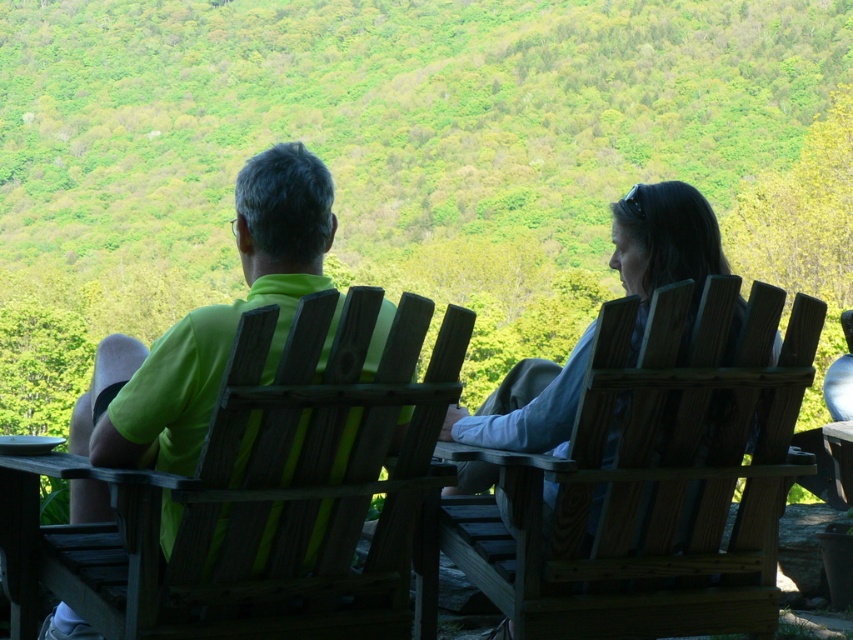
Is wooden chair at right taller than matte green shirt at center?

No.

Between wooden chair at right and matte green shirt at center, which one is positioned higher?

matte green shirt at center

Which is behind, point (746, 330) or point (265, 273)?

The point (746, 330) is more distant.

The image size is (853, 640). Find the location of `wooden chair at right`. wooden chair at right is located at coordinates (653, 483).

In the scene shown: Does wooden chair at left come in front of matte green shirt at center?

Yes, it is in front of matte green shirt at center.

Which is more to the right, wooden chair at left or matte green shirt at center?

wooden chair at left

Is point (397, 520) farther from camera compared to point (213, 324)?

Yes, it is behind point (213, 324).

This screenshot has height=640, width=853. Find the location of `wooden chair at left`. wooden chair at left is located at coordinates (314, 481).

Which is above, wooden chair at right or wooden chair at left?

Positioned higher is wooden chair at left.

Identify the location of wooden chair at right. This screenshot has height=640, width=853. (653, 483).